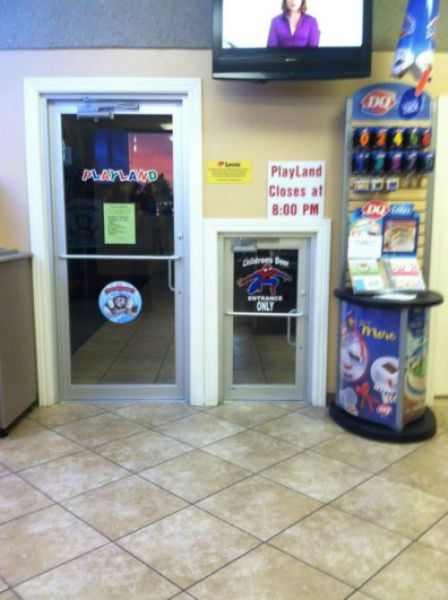
Find the location of a particular element. The height and width of the screenshot is (600, 448). tv screen is located at coordinates (259, 22).